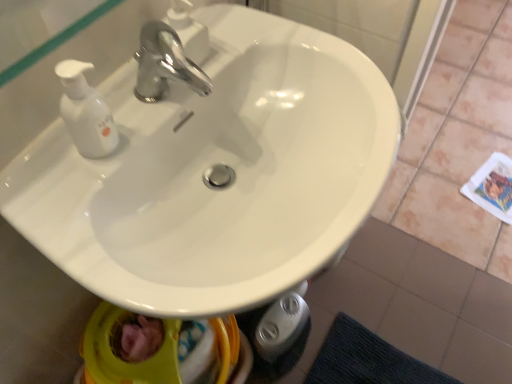
Question: Considering the relative positions of chrome metallic faucet at upper center and white glossy sink at center in the image provided, is chrome metallic faucet at upper center to the left or to the right of white glossy sink at center?

Choices:
 (A) left
 (B) right

Answer: (A)

Question: Which is correct: chrome metallic faucet at upper center is inside white glossy sink at center, or outside of it?

Choices:
 (A) inside
 (B) outside

Answer: (B)

Question: Considering the positions of point (152, 46) and point (95, 183), is point (152, 46) closer or farther from the camera than point (95, 183)?

Choices:
 (A) farther
 (B) closer

Answer: (A)

Question: Is point (185, 173) closer or farther from the camera than point (155, 21)?

Choices:
 (A) closer
 (B) farther

Answer: (B)

Question: Considering the positions of white glossy sink at center and chrome metallic faucet at upper center in the image, is white glossy sink at center taller or shorter than chrome metallic faucet at upper center?

Choices:
 (A) tall
 (B) short

Answer: (A)

Question: In the image, is white glossy sink at center on the left side or the right side of chrome metallic faucet at upper center?

Choices:
 (A) left
 (B) right

Answer: (B)

Question: Considering the positions of white glossy sink at center and chrome metallic faucet at upper center in the image, is white glossy sink at center bigger or smaller than chrome metallic faucet at upper center?

Choices:
 (A) big
 (B) small

Answer: (A)